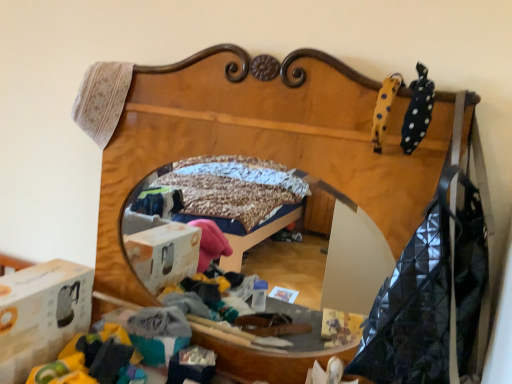
Question: From the image's perspective, is wooden bed frame at center on yellow dotted plush at upper right?

Choices:
 (A) no
 (B) yes

Answer: (A)

Question: Considering the relative positions of wooden bed frame at center and yellow dotted plush at upper right in the image provided, is wooden bed frame at center to the left of yellow dotted plush at upper right from the viewer's perspective?

Choices:
 (A) yes
 (B) no

Answer: (A)

Question: Can you confirm if wooden bed frame at center is smaller than yellow dotted plush at upper right?

Choices:
 (A) yes
 (B) no

Answer: (B)

Question: Could you tell me if wooden bed frame at center is turned towards yellow dotted plush at upper right?

Choices:
 (A) no
 (B) yes

Answer: (A)

Question: From a real-world perspective, is wooden bed frame at center positioned under yellow dotted plush at upper right based on gravity?

Choices:
 (A) no
 (B) yes

Answer: (B)

Question: Considering the relative positions of wooden bed frame at center and white cardboard box at lower left in the image provided, is wooden bed frame at center to the left or to the right of white cardboard box at lower left?

Choices:
 (A) left
 (B) right

Answer: (B)

Question: From a real-world perspective, relative to white cardboard box at lower left, is wooden bed frame at center vertically above or below?

Choices:
 (A) above
 (B) below

Answer: (A)

Question: In terms of width, does wooden bed frame at center look wider or thinner when compared to white cardboard box at lower left?

Choices:
 (A) thin
 (B) wide

Answer: (B)

Question: Considering their positions, is wooden bed frame at center located in front of or behind white cardboard box at lower left?

Choices:
 (A) front
 (B) behind

Answer: (A)

Question: Is yellow dotted plush at upper right taller or shorter than black dotted fabric at upper right?

Choices:
 (A) tall
 (B) short

Answer: (B)

Question: Looking at the image, does yellow dotted plush at upper right seem bigger or smaller compared to black dotted fabric at upper right?

Choices:
 (A) small
 (B) big

Answer: (A)

Question: From the image's perspective, relative to black dotted fabric at upper right, is yellow dotted plush at upper right above or below?

Choices:
 (A) above
 (B) below

Answer: (A)

Question: Is point (375, 150) closer or farther from the camera than point (430, 119)?

Choices:
 (A) closer
 (B) farther

Answer: (B)

Question: From the image's perspective, is black dotted fabric at upper right above or below white cardboard box at lower left?

Choices:
 (A) above
 (B) below

Answer: (A)

Question: Is black dotted fabric at upper right taller or shorter than white cardboard box at lower left?

Choices:
 (A) short
 (B) tall

Answer: (A)